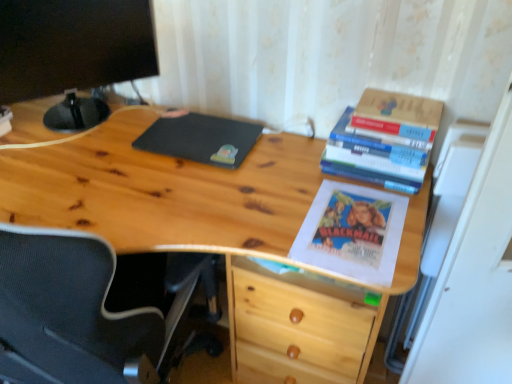
What are the coordinates of `unoccupied area in front of hardcover books at upper right, acting as the 2th book starting from the top` in the screenshot? It's located at (371, 212).